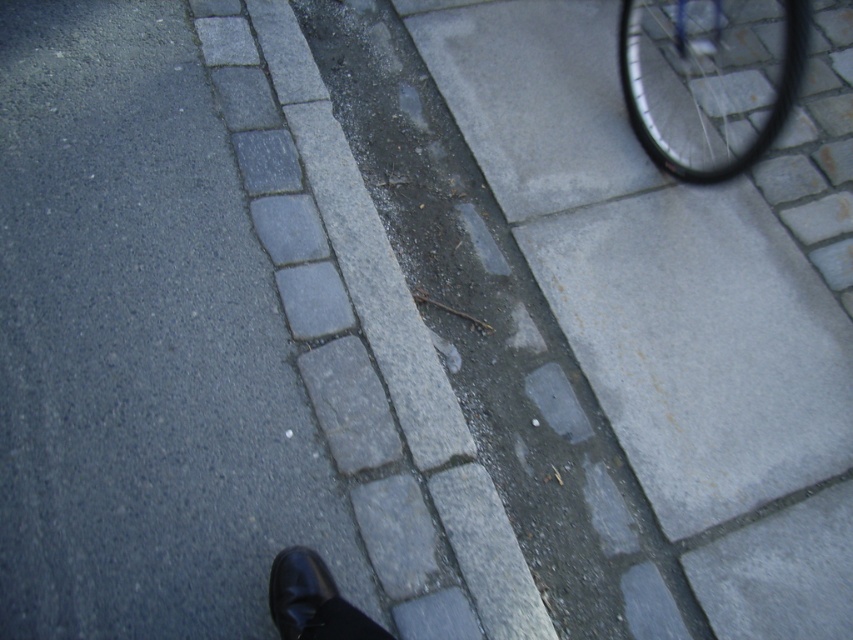
You are standing on the pavement and see the shiny metallic wheel at upper right and the black leather shoe at lower left. Which object is positioned higher in the image?

The shiny metallic wheel at upper right is located above the black leather shoe at lower left in the image.

You are a delivery robot trying to navigate the pavement. You see the gray stone curb at center and the shiny metallic wheel at upper right. Which object is closer to you as you move forward?

The gray stone curb at center is closer to you because it is in front of the shiny metallic wheel at upper right.

Looking at this image, you are standing on the pavement in the street scene and want to walk towards the point that is closer to you. Which point should you head towards, point (437, 456) or point (669, 38)?

You should head towards point (437, 456) because it is closer to the viewer than point (669, 38).